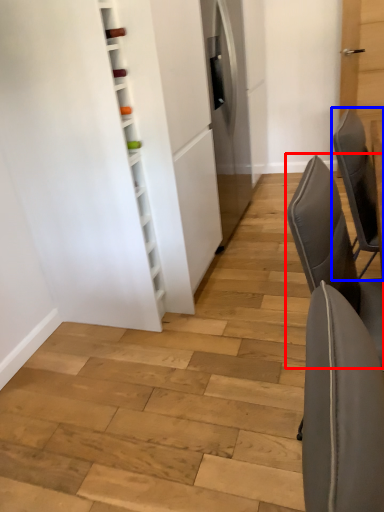
Question: Which object appears closest to the camera in this image, chair (highlighted by a red box) or chair (highlighted by a blue box)?

Choices:
 (A) chair
 (B) chair

Answer: (A)